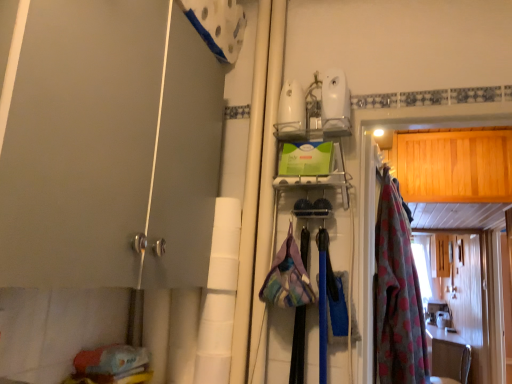
Question: From the image's perspective, is matte gray door at left above or below pink floral fabric at right?

Choices:
 (A) above
 (B) below

Answer: (A)

Question: From a real-world perspective, is matte gray door at left positioned above or below pink floral fabric at right?

Choices:
 (A) below
 (B) above

Answer: (B)

Question: Which object is the farthest from the white glossy countertop at lower right?

Choices:
 (A) pink floral fabric at right
 (B) wooden cabinet at right
 (C) matte gray door at left

Answer: (C)

Question: Which object is positioned farthest from the matte gray door at left?

Choices:
 (A) pink floral fabric at right
 (B) wooden cabinet at right
 (C) white glossy countertop at lower right

Answer: (C)